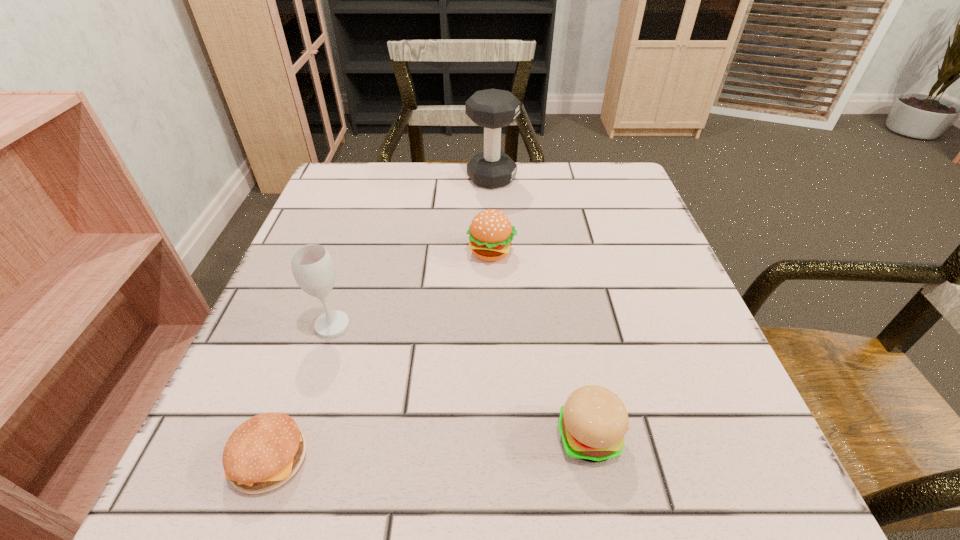
At what (x,y) coordinates should I click in order to perform the action: click on free space that satisfies the following two spatial constraints: 1. on the back side of the third farthest object; 2. on the left side of the farthest object. Please return your answer as a coordinate pair (x, y). Looking at the image, I should click on (379, 178).

What are the coordinates of `vacant space that satisfies the following two spatial constraints: 1. on the front side of the dumbbell; 2. on the left side of the rightmost object` in the screenshot? It's located at (501, 436).

This screenshot has height=540, width=960. In order to click on vacant space that satisfies the following two spatial constraints: 1. on the front side of the second shortest object; 2. on the right side of the second farthest object in this screenshot , I will do `click(496, 436)`.

I want to click on vacant space that satisfies the following two spatial constraints: 1. on the back side of the shortest hamburger; 2. on the left side of the fourth tallest object, so click(278, 436).